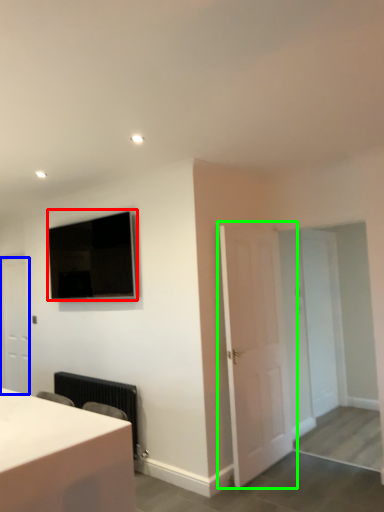
Question: Which object is positioned closest to television (highlighted by a red box)? Select from door (highlighted by a blue box) and door (highlighted by a green box).

Choices:
 (A) door
 (B) door

Answer: (A)